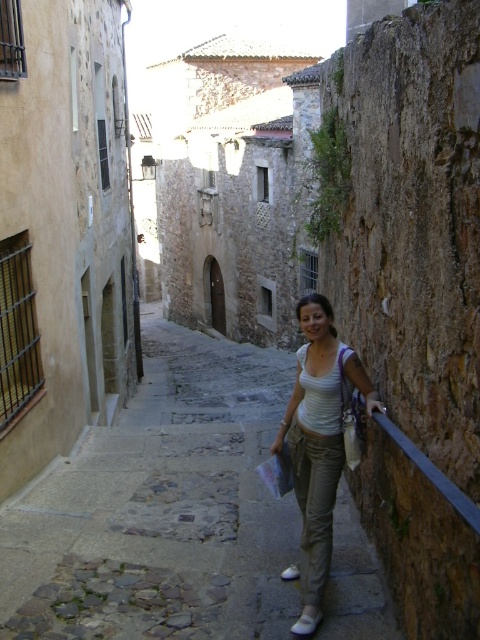
Does matte stone stairs at center come behind light beige cotton pants at center?

No, it is in front of light beige cotton pants at center.

Can you confirm if matte stone stairs at center is positioned below light beige cotton pants at center?

Correct, matte stone stairs at center is located below light beige cotton pants at center.

I want to click on matte stone stairs at center, so click(x=162, y=508).